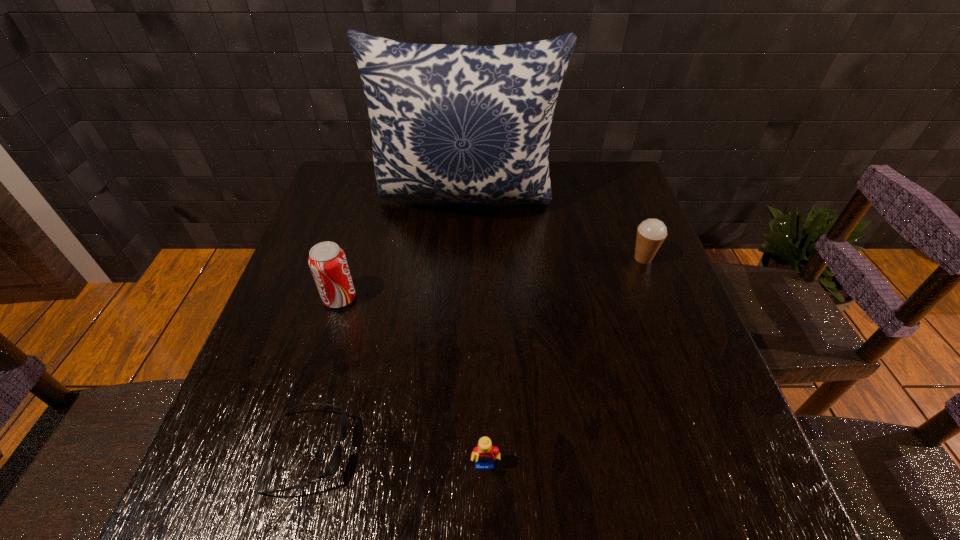
Where is `object located in the near left corner section of the desktop`? The height and width of the screenshot is (540, 960). object located in the near left corner section of the desktop is located at coordinates (334, 464).

Find the location of a particular element. free region at the near edge of the desktop is located at coordinates (498, 488).

Find the location of a particular element. The height and width of the screenshot is (540, 960). vacant region at the left edge is located at coordinates (264, 410).

This screenshot has height=540, width=960. In the image, there is a desktop. Find the location of `vacant region at the right edge`. vacant region at the right edge is located at coordinates (631, 318).

This screenshot has width=960, height=540. Identify the location of vacant space at the far left corner of the desktop. click(328, 205).

What are the coordinates of `free location at the near right corner` in the screenshot? It's located at (736, 469).

At what (x,y) coordinates should I click in order to perform the action: click on vacant area that lies between the shortest object and the fourth shortest object. Please return your answer as a coordinate pair (x, y). Looking at the image, I should click on 324,375.

I want to click on vacant space in between the Lego and the shortest object, so point(397,460).

Identify the location of unoccupied area between the third nearest object and the fourth tallest object. This screenshot has height=540, width=960. click(x=413, y=383).

I want to click on free point between the rightmost object and the sunglasses, so click(476, 355).